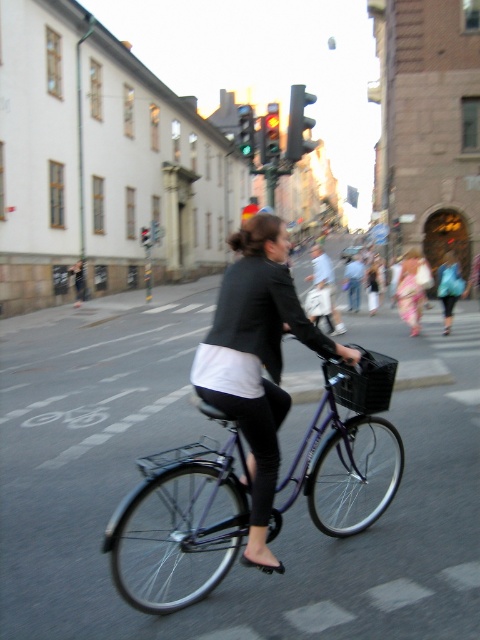
Question: Does matte black jacket at center appear under green glass traffic light at upper center?

Choices:
 (A) yes
 (B) no

Answer: (A)

Question: Which point is farther to the camera?

Choices:
 (A) (143, 227)
 (B) (269, 257)
 (C) (253, 152)
 (D) (415, 262)

Answer: (A)

Question: Which of the following is the farthest from the observer?

Choices:
 (A) glassy red traffic light at upper center
 (B) metallic purple bicycle at center
 (C) matte black jacket at center

Answer: (A)

Question: Which object is farther from the camera taking this photo?

Choices:
 (A) floral fabric dress at center
 (B) matte black jacket at center

Answer: (A)

Question: Can you confirm if floral fabric dress at center is positioned to the right of glassy red traffic light at upper center?

Choices:
 (A) no
 (B) yes

Answer: (B)

Question: Can you confirm if matte black jacket at center is positioned above floral fabric dress at center?

Choices:
 (A) no
 (B) yes

Answer: (A)